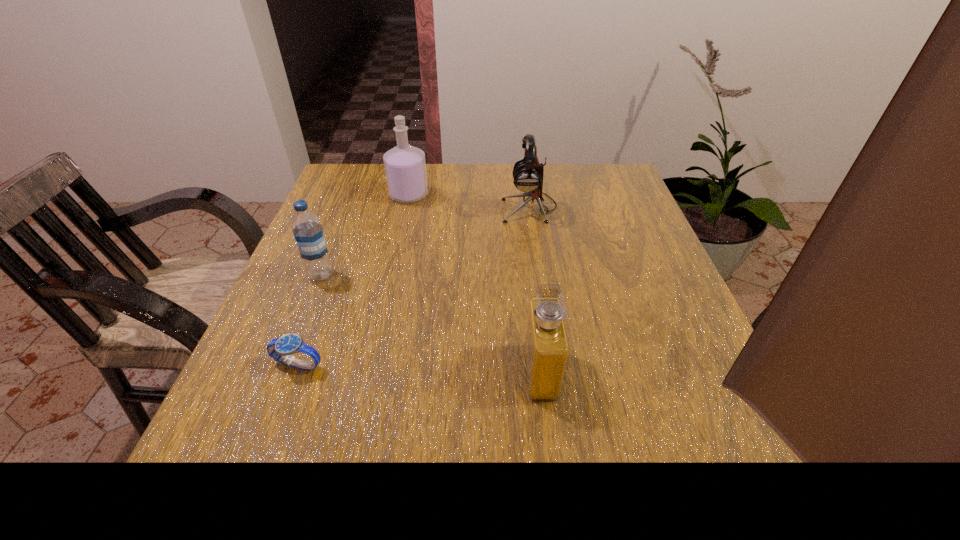
Where is `free point located on the front-facing side of the shorter perfume`? This screenshot has width=960, height=540. free point located on the front-facing side of the shorter perfume is located at coordinates (396, 372).

Identify the location of vacant region located on the front-facing side of the shorter perfume. This screenshot has height=540, width=960. (385, 372).

What are the coordinates of `free spot located on the label of the third farthest object` in the screenshot? It's located at (271, 402).

I want to click on free region located on the back of the shortest object, so pyautogui.click(x=325, y=291).

You are a GUI agent. You are given a task and a screenshot of the screen. Output one action in this format:
    pyautogui.click(x=<x>, y=<y>)
    Task: Click on the perfume located at the far edge
    The width and height of the screenshot is (960, 540).
    Given the screenshot: What is the action you would take?
    pyautogui.click(x=405, y=167)

Where is `earphone that is at the far edge`? The height and width of the screenshot is (540, 960). earphone that is at the far edge is located at coordinates (528, 173).

Locate an element on the screen. The width and height of the screenshot is (960, 540). perfume located in the left edge section of the desktop is located at coordinates (405, 167).

Identify the location of water bottle that is positioned at the left edge. (306, 226).

Where is `watch present at the left edge`? watch present at the left edge is located at coordinates (281, 349).

Where is `object at the far left corner`? object at the far left corner is located at coordinates coord(405,167).